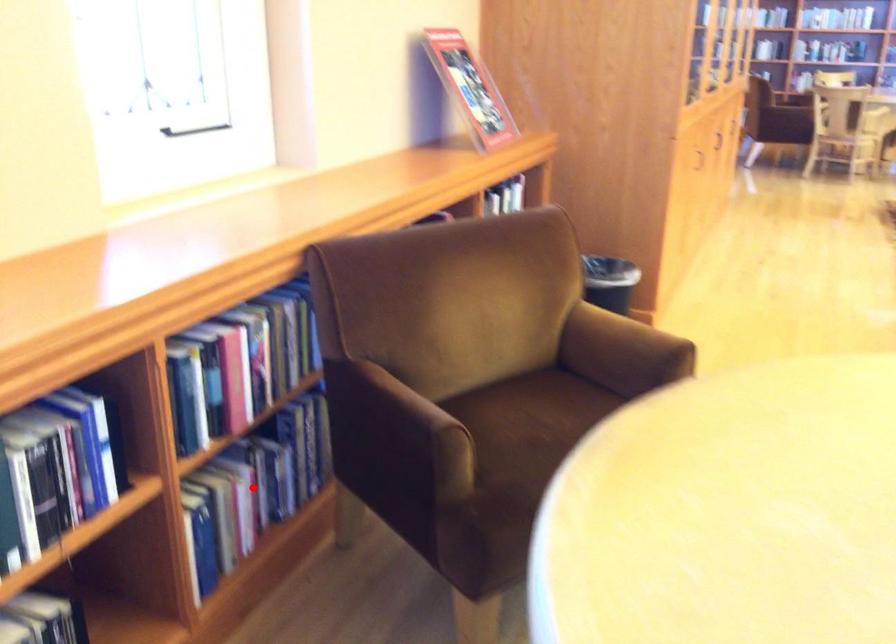
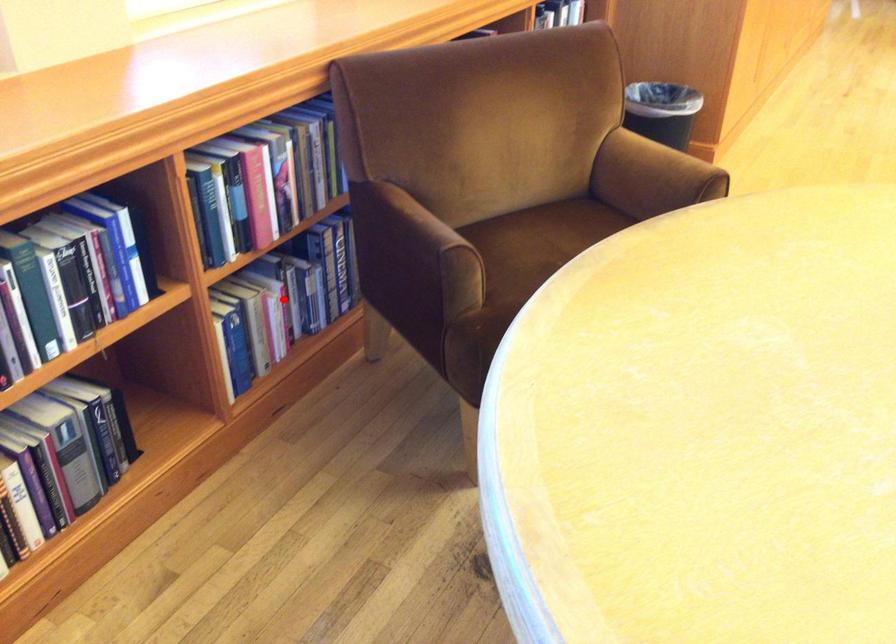
I am providing you with two images of the same scene from different viewpoints. A red point is marked on the first image and another point is marked on the second image. Is the marked point in image1 the same physical position as the marked point in image2?

Yes